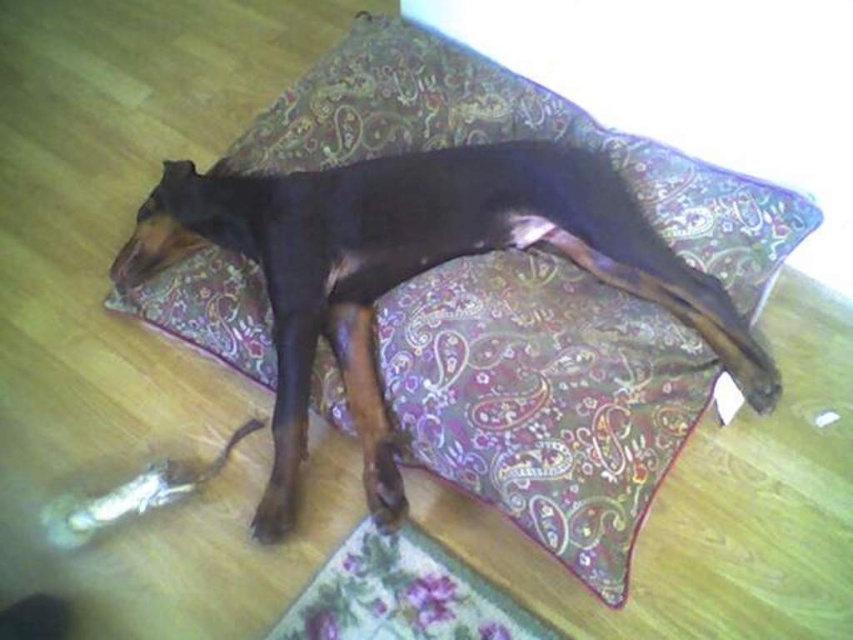
You are a dog trainer entering a room and see the black glossy dog at center and the floral fabric mat at lower center. Which object is higher in height?

The black glossy dog at center is taller than the floral fabric mat at lower center.

You are standing in the room and want to pick up an object. There are two points marked in the image. Which point, point (329, 230) or point (427, 538), is closer to you?

Point (329, 230) is closer to the viewer than point (427, 538).